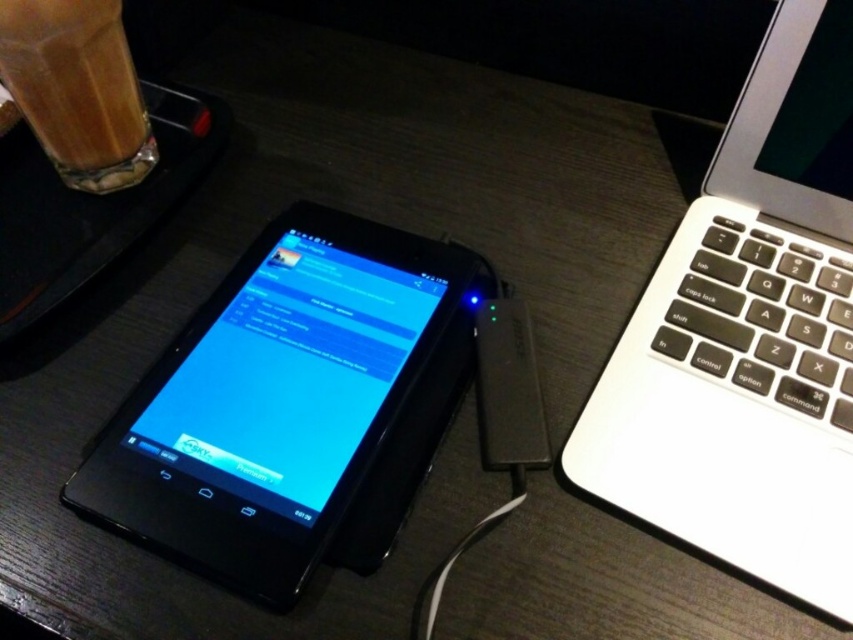
You are setting up a desk organizer and need to know the relative sizes of the items. Which object is taller between the black glossy tablet at center and the white plastic ipod at center?

The black glossy tablet at center is taller than the white plastic ipod at center according to the description.

You are organizing your desk and want to place a decorative item between the black glossy tablet at center and the white plastic ipod at center. Since both items are at the center, how can you determine which one is closer to you?

The black glossy tablet at center is closer to the viewer than the white plastic ipod at center, so you should place the decorative item between them by positioning it closer to the white plastic ipod at center to maintain equal distance from both.

You are setting up a new monitor stand in the workspace shown. The stand requires the monitor to be placed exactly at coordinate point 0.6, 0.3. Is the black glossy tablet at center currently positioned close enough to this point to use the stand?

The black glossy tablet at center is located at point (274, 400), which is within 0.025 units of the required (254, 384) coordinates. Therefore, the tablet can be used with the stand.